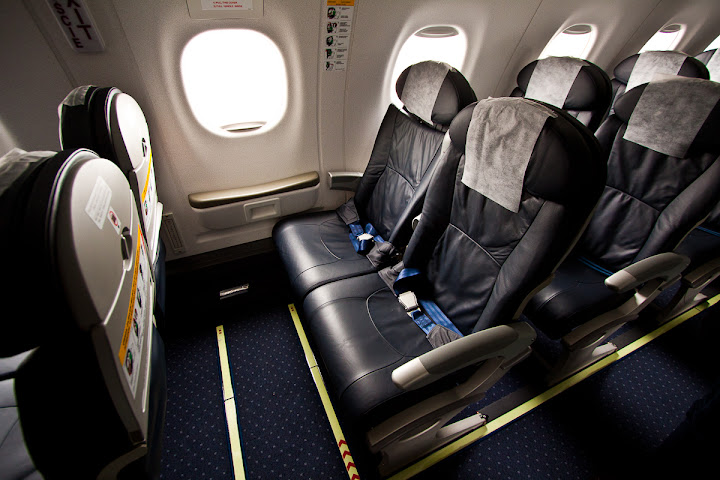
At what (x,y) coordinates should I click in order to perform the action: click on armrests. Please return your answer as a coordinate pair (x, y). Image resolution: width=720 pixels, height=480 pixels. Looking at the image, I should click on (703, 274), (651, 274), (433, 362), (343, 187).